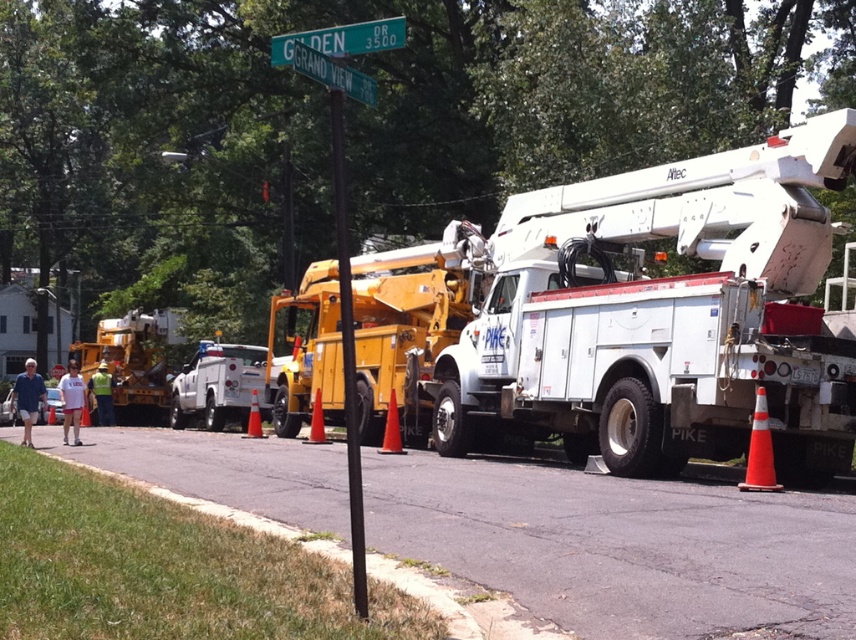
You are a delivery driver who needs to park your vehicle between the orange matte traffic cone at center and the orange plastic traffic cone at center. Can you fit your car there?

The orange matte traffic cone at center is positioned over orange plastic traffic cone at center, meaning they are stacked on top of each other. Since they are stacked, there is no space between them for your vehicle to park.

You are a delivery driver who needs to park your vehicle between the orange matte traffic cone at center and the orange plastic traffic cone at center. Given that your vehicle is 2 meters wide, can you fit between them?

The orange matte traffic cone at center has a lesser width compared to orange plastic traffic cone at center. However, the total space between them isn t specified. Without knowing the distance between the cones, it s impossible to determine if your vehicle will fit.

You are a delivery driver who needs to park your 6.5 meter long truck between the yellow metallic utility truck at center and the green plastic street sign at upper center. Is there enough space for your truck to fit without overlapping either object?

The distance between the yellow metallic utility truck at center and the green plastic street sign at upper center is 9.45 meters. Since your truck is 6.5 meters long, there is sufficient space to park it between them without overlapping either object.